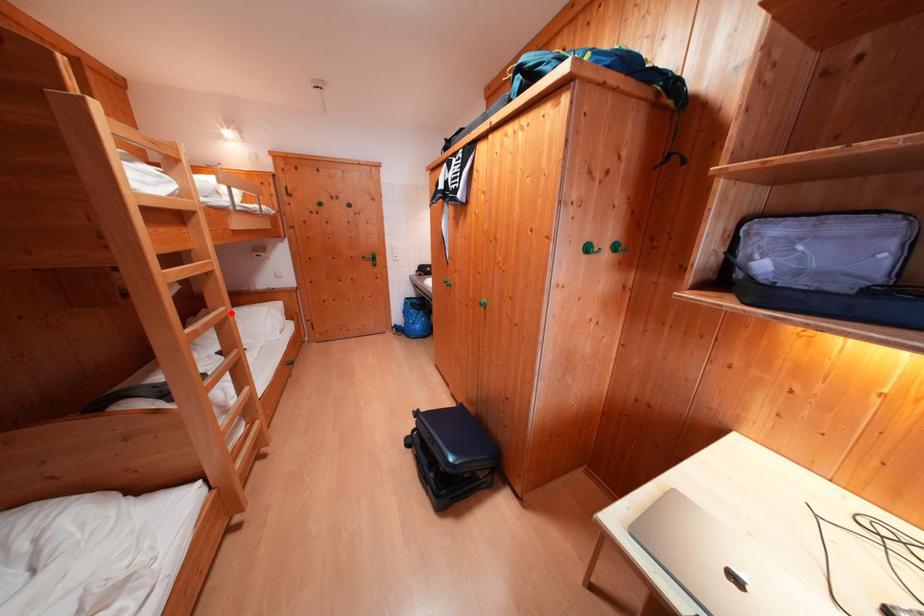
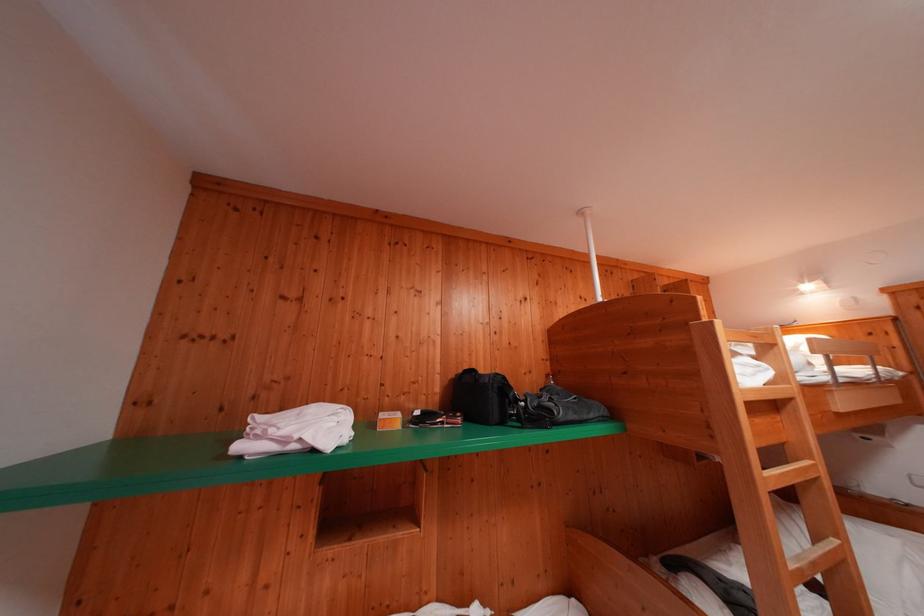
Question: I am providing you with two images of the same scene from different viewpoints. Given a red point in image1, look at the same physical point in image2. Is it:

Choices:
 (A) Closer to the viewpoint
 (B) Farther from the viewpoint

Answer: (A)